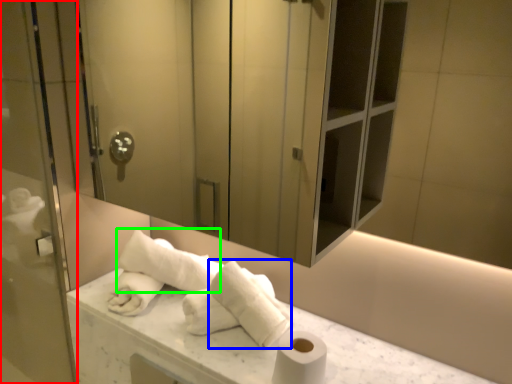
Question: Considering the real-world distances, which object is farthest from screen door (highlighted by a red box)? bath towel (highlighted by a blue box) or bath towel (highlighted by a green box)?

Choices:
 (A) bath towel
 (B) bath towel

Answer: (A)